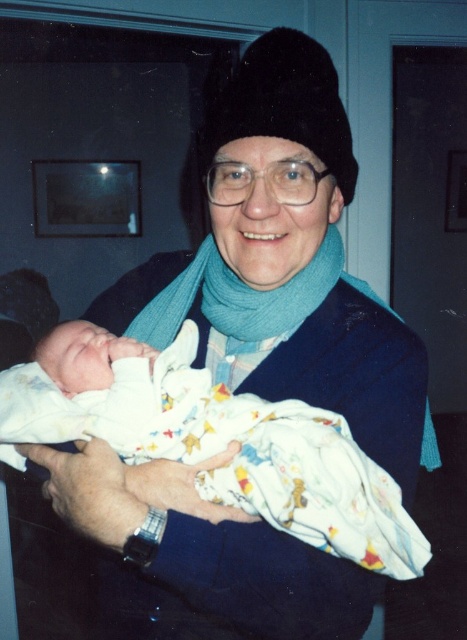
You are a photographer setting up a photo shoot in a cozy indoor setting with a window showing a dark night outside. You need to position two accessories on a mannequin wearing a dark blue sweater. The accessories are the black fuzzy hat at center and the teal soft scarf at center. According to the scene description, which accessory should you place higher on the mannequin to ensure they are arranged similarly to the original image?

The black fuzzy hat at center should be placed higher on the mannequin since it has a smaller size compared to the teal soft scarf at center, allowing it to sit atop the head while the scarf can drape lower around the neck.

You are a photographer trying to capture the newborn baby in the white cotton swaddle at center. You notice the teal soft scarf at center is blocking part of the baby. Can you adjust your position to get a clear shot of the baby without moving any objects?

The white cotton swaddle at center is in front of the teal soft scarf at center, so you can position yourself to focus on the baby through the gap between the swaddle and the scarf, ensuring the scarf doesn not obstruct the view.